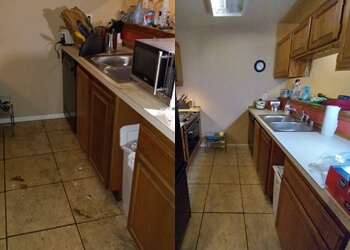
At what (x,y) coordinates should I click in order to perform the action: click on clean floor. Please return your answer as a coordinate pair (x, y). Looking at the image, I should click on (240, 214).